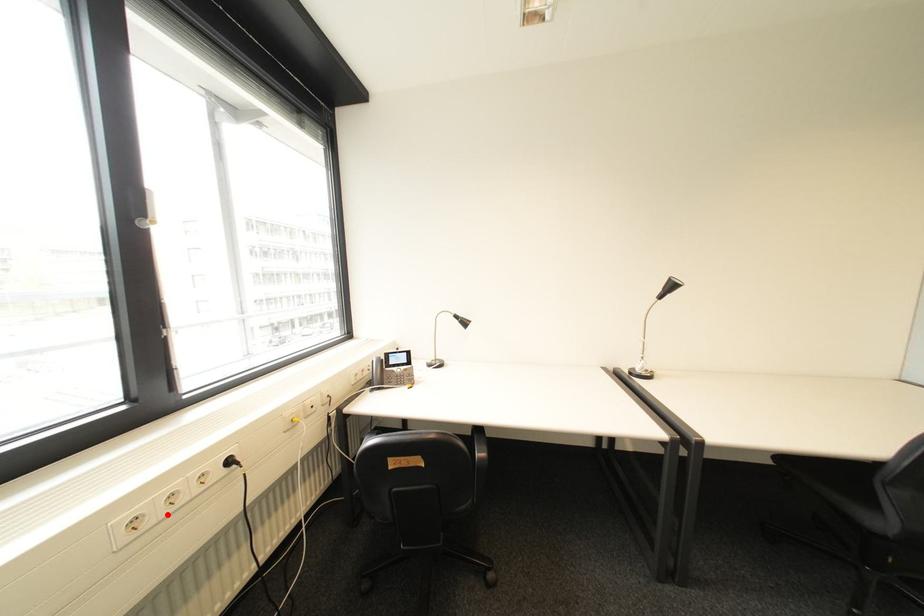
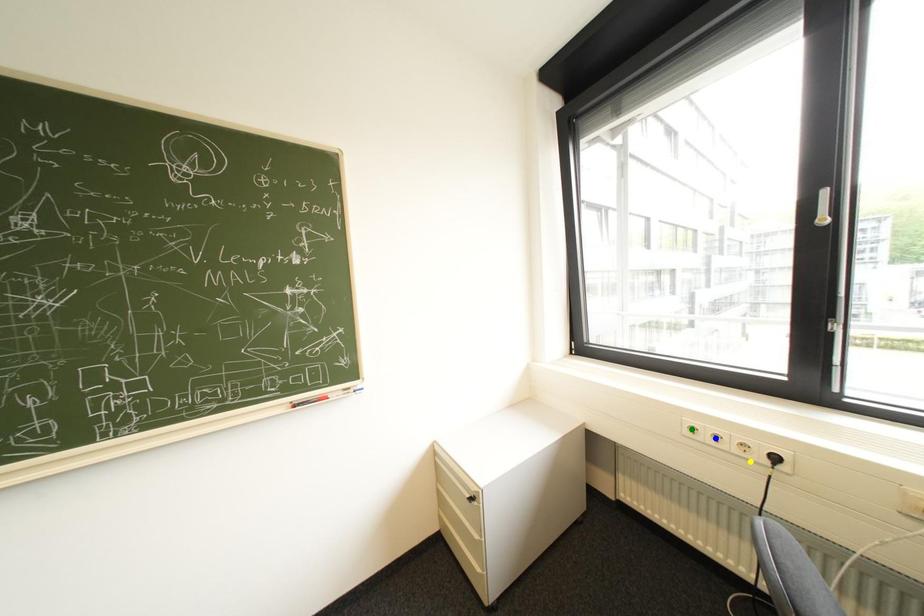
Question: I am providing you with two images of the same scene from different viewpoints. A red point is marked on the first image. You are given multiple points on the second image. Which spot in image 2 lines up with the point in image 1?

Choices:
 (A) blue point
 (B) green point
 (C) yellow point

Answer: (A)